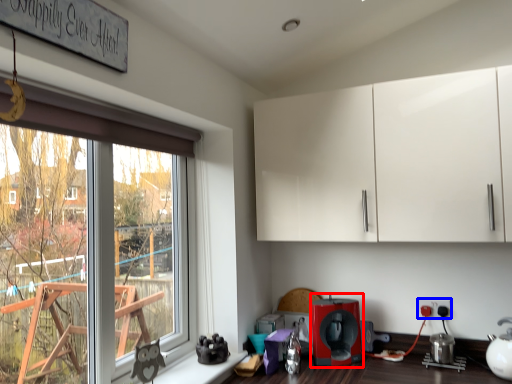
Question: Which of the following is the farthest to the observer, coffee machine (highlighted by a red box) or electric outlet (highlighted by a blue box)?

Choices:
 (A) coffee machine
 (B) electric outlet

Answer: (B)